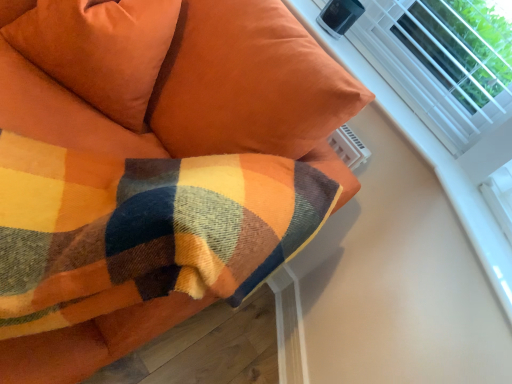
What do you see at coordinates (440, 64) in the screenshot? The width and height of the screenshot is (512, 384). I see `white plastic radiator at upper right` at bounding box center [440, 64].

The height and width of the screenshot is (384, 512). What are the coordinates of `suede-like orange pillow at upper left` in the screenshot? It's located at (96, 48).

Describe the element at coordinates (96, 48) in the screenshot. The image size is (512, 384). I see `suede-like orange pillow at upper left` at that location.

You are a GUI agent. You are given a task and a screenshot of the screen. Output one action in this format:
    pyautogui.click(x=<x>, y=<y>)
    Task: Click on the white plastic radiator at upper right
    
    Given the screenshot: What is the action you would take?
    pyautogui.click(x=440, y=64)

Is plaid wool blanket at upper left oriented towards white plastic radiator at upper right?

No, plaid wool blanket at upper left is not facing towards white plastic radiator at upper right.

Which of these two, plaid wool blanket at upper left or white plastic radiator at upper right, is wider?

With larger width is plaid wool blanket at upper left.

Considering the relative sizes of plaid wool blanket at upper left and white plastic radiator at upper right in the image provided, is plaid wool blanket at upper left shorter than white plastic radiator at upper right?

In fact, plaid wool blanket at upper left may be taller than white plastic radiator at upper right.

From the image's perspective, which is below, plaid wool blanket at upper left or white plastic radiator at upper right?

plaid wool blanket at upper left is shown below in the image.

From the image's perspective, relative to suede-like orange pillow at upper left, is white plastic radiator at upper right above or below?

white plastic radiator at upper right is below suede-like orange pillow at upper left.

Considering the positions of objects white plastic radiator at upper right and suede-like orange pillow at upper left in the image provided, who is more to the right, white plastic radiator at upper right or suede-like orange pillow at upper left?

white plastic radiator at upper right.

Is white plastic radiator at upper right positioned with its back to suede-like orange pillow at upper left?

white plastic radiator at upper right is not turned away from suede-like orange pillow at upper left.

Does white plastic radiator at upper right have a greater width compared to suede-like orange pillow at upper left?

In fact, white plastic radiator at upper right might be narrower than suede-like orange pillow at upper left.

Considering the sizes of objects white plastic radiator at upper right and plaid wool blanket at upper left in the image provided, who is bigger, white plastic radiator at upper right or plaid wool blanket at upper left?

With larger size is plaid wool blanket at upper left.

Between point (421, 51) and point (173, 104), which one is positioned in front?

The point (173, 104) is closer to the camera.

Considering their positions, is white plastic radiator at upper right located in front of or behind plaid wool blanket at upper left?

In the image, white plastic radiator at upper right appears behind plaid wool blanket at upper left.

Considering the positions of points (86, 67) and (403, 68), is point (86, 67) closer to camera compared to point (403, 68)?

Yes.

Considering the sizes of suede-like orange pillow at upper left and white plastic radiator at upper right in the image, is suede-like orange pillow at upper left wider or thinner than white plastic radiator at upper right?

In the image, suede-like orange pillow at upper left appears to be wider than white plastic radiator at upper right.

Considering the sizes of suede-like orange pillow at upper left and white plastic radiator at upper right in the image, is suede-like orange pillow at upper left bigger or smaller than white plastic radiator at upper right?

suede-like orange pillow at upper left is bigger than white plastic radiator at upper right.

Does point (292, 24) appear closer or farther from the camera than point (39, 55)?

Point (292, 24).

Based on the photo, looking at their sizes, would you say plaid wool blanket at upper left is wider or thinner than suede-like orange pillow at upper left?

plaid wool blanket at upper left is wider than suede-like orange pillow at upper left.

Based on their sizes in the image, would you say plaid wool blanket at upper left is bigger or smaller than suede-like orange pillow at upper left?

Clearly, plaid wool blanket at upper left is larger in size than suede-like orange pillow at upper left.

From the image's perspective, which object appears higher, suede-like orange pillow at upper left or plaid wool blanket at upper left?

From the image's view, suede-like orange pillow at upper left is above.

Based on the photo, could you tell me if suede-like orange pillow at upper left is facing plaid wool blanket at upper left?

Yes, suede-like orange pillow at upper left is oriented towards plaid wool blanket at upper left.

From a real-world perspective, is suede-like orange pillow at upper left positioned under plaid wool blanket at upper left based on gravity?

No, from a real-world perspective, suede-like orange pillow at upper left is not beneath plaid wool blanket at upper left.

Considering the relative positions of suede-like orange pillow at upper left and plaid wool blanket at upper left in the image provided, is suede-like orange pillow at upper left behind plaid wool blanket at upper left?

Yes, the depth of suede-like orange pillow at upper left is greater than that of plaid wool blanket at upper left.

Where is `bay window on the right side of plaid wool blanket at upper left`? Image resolution: width=512 pixels, height=384 pixels. bay window on the right side of plaid wool blanket at upper left is located at coordinates (440, 64).

At what (x,y) coordinates should I click in order to perform the action: click on pillow directly beneath the white plastic radiator at upper right (from a real-world perspective). Please return your answer as a coordinate pair (x, y). The image size is (512, 384). Looking at the image, I should click on (96, 48).

From the image, which object appears to be nearer to white plastic radiator at upper right, plaid wool blanket at upper left or suede-like orange pillow at upper left?

Among the two, plaid wool blanket at upper left is located nearer to white plastic radiator at upper right.

From the image, which object appears to be farther from white plastic radiator at upper right, suede-like orange pillow at upper left or plaid wool blanket at upper left?

suede-like orange pillow at upper left lies further to white plastic radiator at upper right than the other object.

When comparing their distances from plaid wool blanket at upper left, does white plastic radiator at upper right or suede-like orange pillow at upper left seem closer?

suede-like orange pillow at upper left.

Estimate the real-world distances between objects in this image. Which object is further from suede-like orange pillow at upper left, plaid wool blanket at upper left or white plastic radiator at upper right?

Among the two, white plastic radiator at upper right is located further to suede-like orange pillow at upper left.

Considering their positions, is white plastic radiator at upper right positioned closer to suede-like orange pillow at upper left than plaid wool blanket at upper left?

plaid wool blanket at upper left is positioned closer to the anchor suede-like orange pillow at upper left.

Looking at the image, which one is located further to plaid wool blanket at upper left, suede-like orange pillow at upper left or white plastic radiator at upper right?

white plastic radiator at upper right.

The width and height of the screenshot is (512, 384). I want to click on pillow positioned between plaid wool blanket at upper left and white plastic radiator at upper right from near to far, so tap(96, 48).